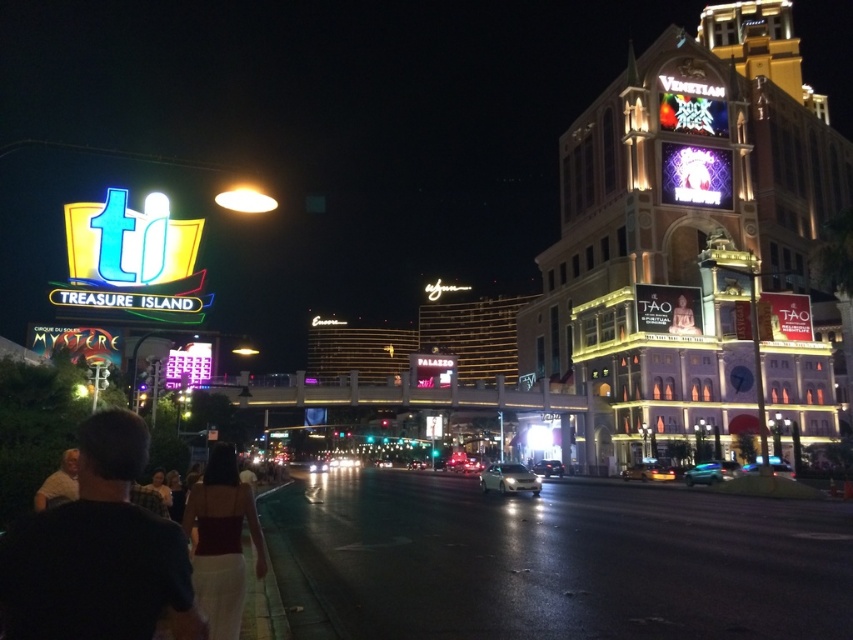
Question: Can you confirm if light brown shirt at lower left is positioned to the right of shiny silver car at center?

Choices:
 (A) yes
 (B) no

Answer: (B)

Question: Estimate the real-world distances between objects in this image. Which object is farther from the yellow metallic car at center?

Choices:
 (A) brown fabric dress at lower left
 (B) shiny silver car at center
 (C) shiny silver sedan at center
 (D) light brown shirt at lower left

Answer: (D)

Question: Does shiny silver car at center have a lesser width compared to shiny silver sedan at center?

Choices:
 (A) yes
 (B) no

Answer: (B)

Question: Among these objects, which one is nearest to the camera?

Choices:
 (A) shiny silver car at center
 (B) shiny silver sedan at center

Answer: (B)

Question: Among these objects, which one is nearest to the camera?

Choices:
 (A) shiny silver car at center
 (B) light brown shirt at lower left

Answer: (B)

Question: Is white glossy car at center positioned before yellow metallic car at center?

Choices:
 (A) yes
 (B) no

Answer: (A)